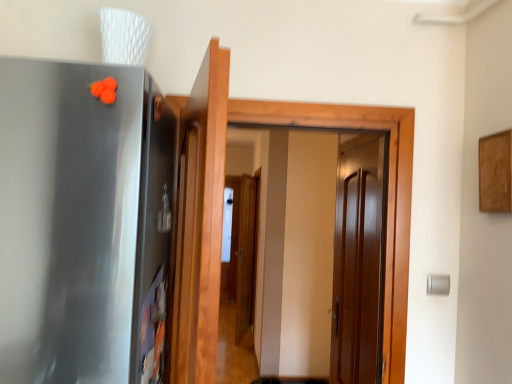
Question: Is satin metallic refrigerator at left not within glossy wood door at center, the first door when ordered from right to left?

Choices:
 (A) no
 (B) yes

Answer: (B)

Question: Does satin metallic refrigerator at left have a lesser width compared to glossy wood door at center, the first door when ordered from right to left?

Choices:
 (A) no
 (B) yes

Answer: (A)

Question: Is satin metallic refrigerator at left smaller than glossy wood door at center, the first door when ordered from right to left?

Choices:
 (A) no
 (B) yes

Answer: (A)

Question: Is satin metallic refrigerator at left with glossy wood door at center, arranged as the first door when viewed from the back?

Choices:
 (A) no
 (B) yes

Answer: (A)

Question: Would you say satin metallic refrigerator at left is a long distance from glossy wood door at center, arranged as the first door when viewed from the back?

Choices:
 (A) no
 (B) yes

Answer: (B)

Question: Is satin metallic refrigerator at left to the right of glossy wood door at center, the 2th door from the front, from the viewer's perspective?

Choices:
 (A) yes
 (B) no

Answer: (B)

Question: Is glossy wood door at center, the 2th door from the front, to the right of satin metallic refrigerator at left from the viewer's perspective?

Choices:
 (A) no
 (B) yes

Answer: (B)

Question: Does glossy wood door at center, arranged as the first door when viewed from the back, have a smaller size compared to satin metallic refrigerator at left?

Choices:
 (A) no
 (B) yes

Answer: (B)

Question: From a real-world perspective, is glossy wood door at center, arranged as the second door when viewed from the left, under satin metallic refrigerator at left?

Choices:
 (A) yes
 (B) no

Answer: (A)

Question: Is glossy wood door at center, the first door when ordered from right to left, positioned in front of satin metallic refrigerator at left?

Choices:
 (A) no
 (B) yes

Answer: (A)

Question: Is satin metallic refrigerator at left located within glossy wood door at center, arranged as the second door when viewed from the left?

Choices:
 (A) no
 (B) yes

Answer: (A)

Question: Considering the relative sizes of glossy wood door at center, arranged as the first door when viewed from the back, and satin metallic refrigerator at left in the image provided, is glossy wood door at center, arranged as the first door when viewed from the back, bigger than satin metallic refrigerator at left?

Choices:
 (A) yes
 (B) no

Answer: (B)

Question: Can you confirm if wooden door at center, acting as the 2th door starting from the right, is positioned to the right of glossy wood door at center, arranged as the second door when viewed from the left?

Choices:
 (A) no
 (B) yes

Answer: (A)